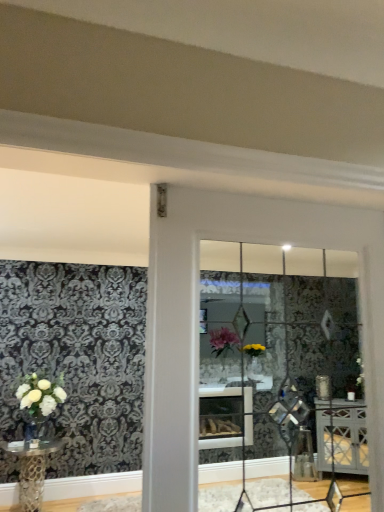
Question: Does clear glass vase at lower left turn towards clear glass door at center?

Choices:
 (A) no
 (B) yes

Answer: (B)

Question: Considering the relative sizes of clear glass vase at lower left and clear glass door at center in the image provided, is clear glass vase at lower left thinner than clear glass door at center?

Choices:
 (A) yes
 (B) no

Answer: (B)

Question: Can you confirm if clear glass vase at lower left is bigger than clear glass door at center?

Choices:
 (A) no
 (B) yes

Answer: (A)

Question: Is clear glass vase at lower left placed right next to clear glass door at center?

Choices:
 (A) no
 (B) yes

Answer: (A)

Question: From a real-world perspective, is clear glass vase at lower left below clear glass door at center?

Choices:
 (A) yes
 (B) no

Answer: (A)

Question: Can you confirm if clear glass vase at lower left is wider than clear glass door at center?

Choices:
 (A) yes
 (B) no

Answer: (A)

Question: Considering the relative positions of metallic gold table at lower left and clear glass vase at lower left in the image provided, is metallic gold table at lower left to the left of clear glass vase at lower left from the viewer's perspective?

Choices:
 (A) no
 (B) yes

Answer: (B)

Question: Does metallic gold table at lower left lie in front of clear glass vase at lower left?

Choices:
 (A) no
 (B) yes

Answer: (B)

Question: From the image's perspective, is metallic gold table at lower left beneath clear glass vase at lower left?

Choices:
 (A) yes
 (B) no

Answer: (A)

Question: From a real-world perspective, does metallic gold table at lower left sit lower than clear glass vase at lower left?

Choices:
 (A) no
 (B) yes

Answer: (B)

Question: Is metallic gold table at lower left surrounding clear glass vase at lower left?

Choices:
 (A) no
 (B) yes

Answer: (A)

Question: Can you see metallic gold table at lower left touching clear glass vase at lower left?

Choices:
 (A) no
 (B) yes

Answer: (A)

Question: From a real-world perspective, is metallic gold table at lower left located beneath clear glass door at center?

Choices:
 (A) no
 (B) yes

Answer: (B)